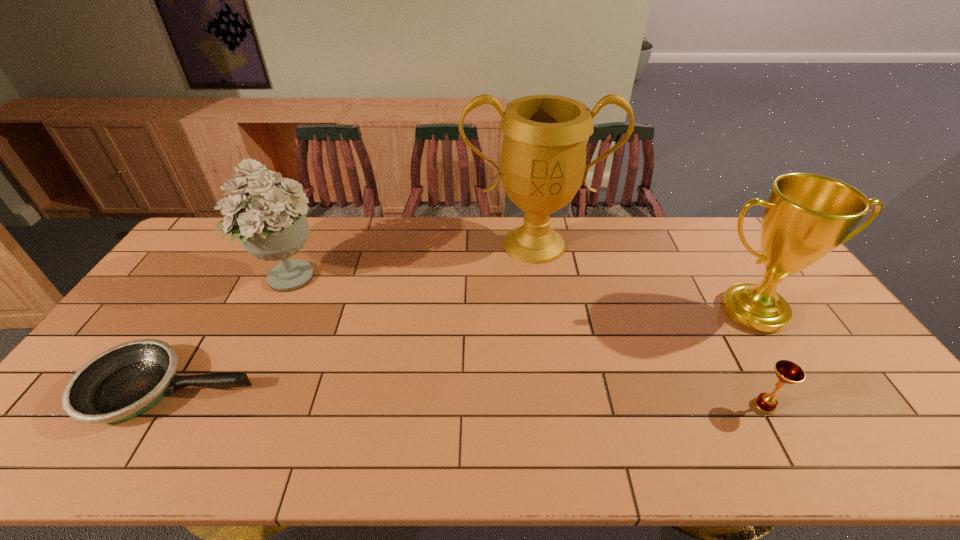
Locate an element on the screen. The width and height of the screenshot is (960, 540). vacant area between the shortest object and the award is located at coordinates (462, 350).

Where is `vacant area that lies between the bouquet and the trophy`? vacant area that lies between the bouquet and the trophy is located at coordinates (411, 261).

Locate which object ranks fourth in proximity to the shortest object. Please provide its 2D coordinates. Your answer should be formatted as a tuple, i.e. [(x, y)], where the tuple contains the x and y coordinates of a point satisfying the conditions above.

[(788, 372)]

This screenshot has height=540, width=960. In order to click on object that stands as the fourth closest to the fourth tallest object in this screenshot , I will do `click(125, 381)`.

Identify the location of free spot that satisfies the following two spatial constraints: 1. on the handle side of the frying pan; 2. on the right side of the second shortest object. (160, 406).

Locate an element on the screen. This screenshot has width=960, height=540. free region that satisfies the following two spatial constraints: 1. by the handles of the award; 2. on the handle side of the shortest object is located at coordinates (803, 389).